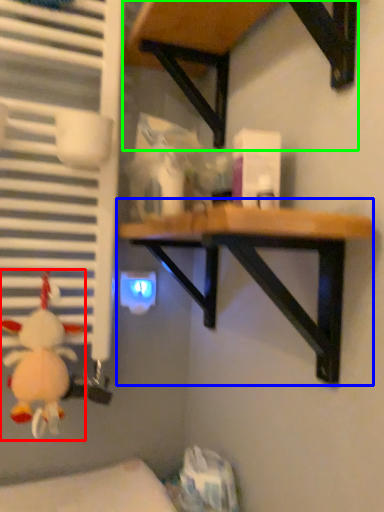
Question: Based on their relative distances, which object is farther from toy (highlighted by a red box)? Choose from table (highlighted by a blue box) and table (highlighted by a green box).

Choices:
 (A) table
 (B) table

Answer: (B)